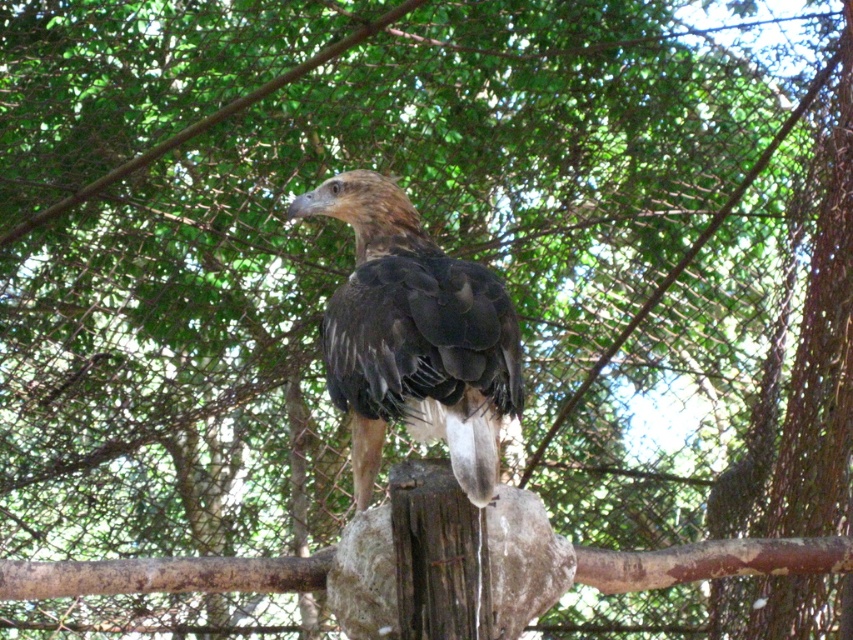
You are a zookeeper who wants to place a treat for the bird. The point you need to target is point [415,337]. Where exactly on the brown feathered eagle at center should you aim?

The point [415,337] is on the brown feathered eagle at center, so you should aim at the brown feathered eagle at center.

You are a zookeeper observing the brown feathered eagle at center and the smooth gray stone at center. Which object is located higher in the image?

The brown feathered eagle at center is positioned over the smooth gray stone at center, so it is higher.

In the scene shown: You are a zookeeper observing the brown feathered eagle at center and the smooth gray stone at center. Which object is taller?

The brown feathered eagle at center is taller than the smooth gray stone at center.